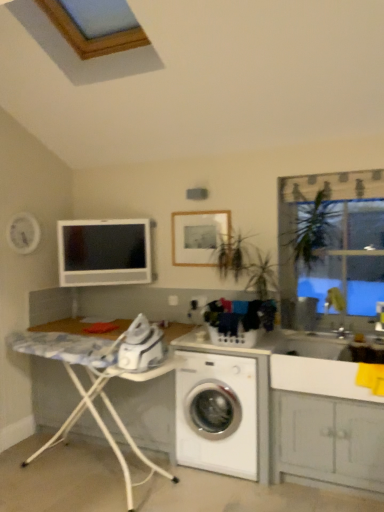
Question: From their relative heights in the image, would you say white marble ironing board at lower left is taller or shorter than matte white computer monitor at upper left?

Choices:
 (A) short
 (B) tall

Answer: (B)

Question: From a real-world perspective, is white marble ironing board at lower left physically located above or below matte white computer monitor at upper left?

Choices:
 (A) above
 (B) below

Answer: (B)

Question: Estimate the real-world distances between objects in this image. Which object is farther from the matte wooden picture frame at upper center?

Choices:
 (A) white plastic washing machine at lower center
 (B) white painted wood cabinet at lower right
 (C) white glossy sink at center, acting as the first sink starting from the top
 (D) white glossy sink at lower right, positioned as the 2th sink in top-to-bottom order
 (E) matte white computer monitor at upper left

Answer: (B)

Question: Which object is positioned closest to the white painted wood cabinet at lower right?

Choices:
 (A) matte white computer monitor at upper left
 (B) clear glass window at upper right
 (C) white glossy sink at center, acting as the first sink starting from the top
 (D) white plastic washing machine at lower center
 (E) matte wooden picture frame at upper center

Answer: (D)